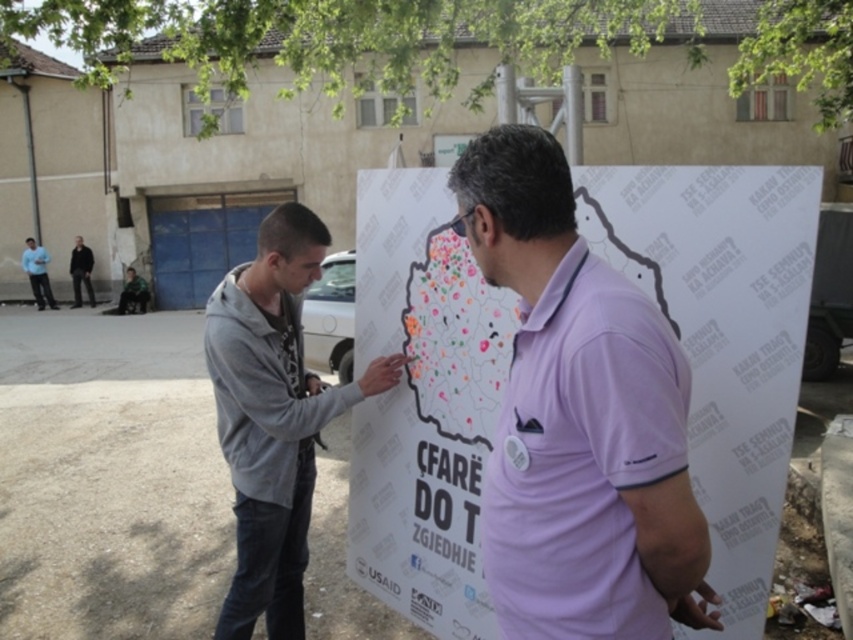
Question: Does purple cotton polo shirt at center have a smaller size compared to gray fleece jacket at center?

Choices:
 (A) yes
 (B) no

Answer: (B)

Question: Which of these objects is positioned closest to the gray fleece jacket at center?

Choices:
 (A) purple cotton polo shirt at center
 (B) dark gray jeans at left
 (C) light blue shirt at left
 (D) gray hoodie at left

Answer: (D)

Question: Which object is positioned farthest from the light blue shirt at left?

Choices:
 (A) gray fleece jacket at center
 (B) purple cotton polo shirt at center
 (C) dark gray jeans at left
 (D) gray hoodie at left

Answer: (B)

Question: Estimate the real-world distances between objects in this image. Which object is closer to the gray fleece jacket at center?

Choices:
 (A) purple cotton polo shirt at center
 (B) dark gray jeans at left
 (C) gray hoodie at left
 (D) light blue shirt at left

Answer: (C)

Question: Is gray fleece jacket at center wider than dark gray jeans at left?

Choices:
 (A) yes
 (B) no

Answer: (B)

Question: Does gray fleece jacket at center appear on the left side of light blue shirt at left?

Choices:
 (A) no
 (B) yes

Answer: (A)